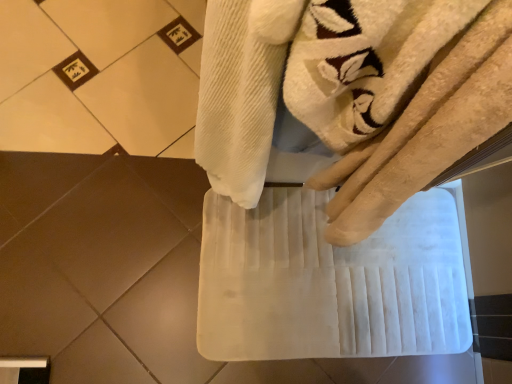
Question: Should I look upward or downward to see white fabric bath towel at center?

Choices:
 (A) up
 (B) down

Answer: (B)